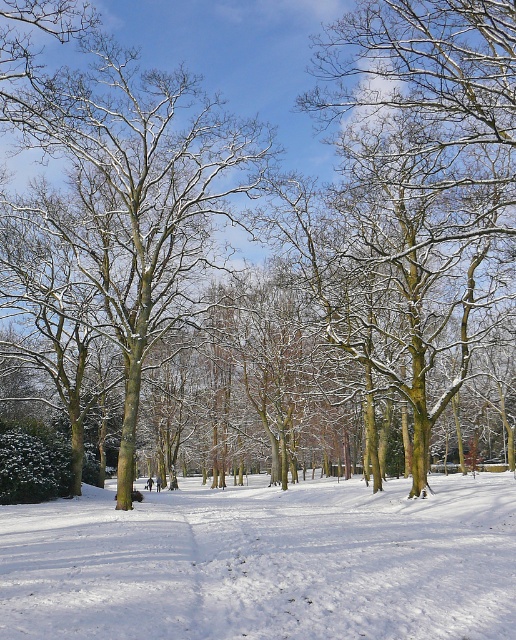
Is point (330, 493) in front of point (95, 118)?

That is False.

Is white powdery snow at center wider than snow-covered bark tree at center?

Correct, the width of white powdery snow at center exceeds that of snow-covered bark tree at center.

At what (x,y) coordinates should I click in order to perform the action: click on white powdery snow at center. Please return your answer as a coordinate pair (x, y). Looking at the image, I should click on (265, 563).

In order to click on white powdery snow at center in this screenshot , I will do `click(265, 563)`.